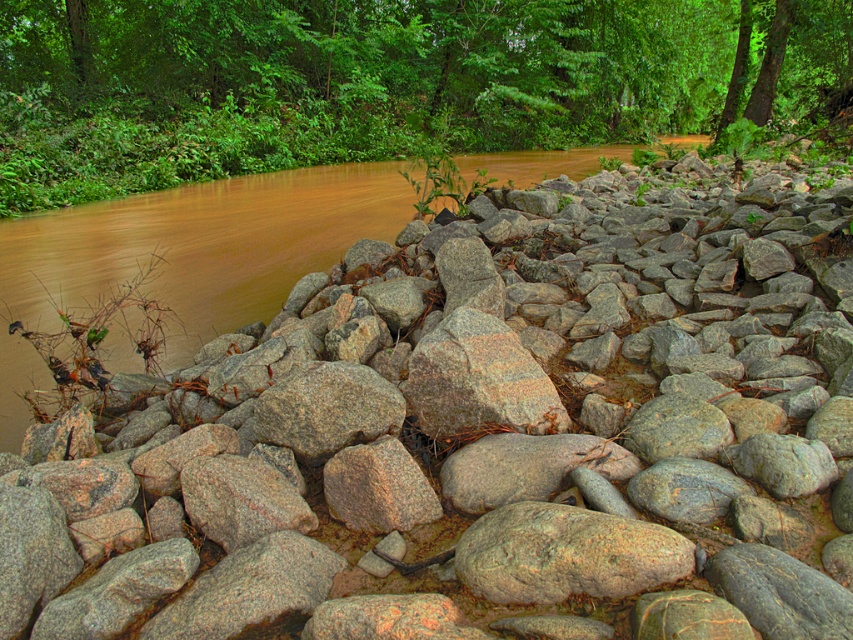
You are standing at the riverbank and see the green leafy tree at upper center and the granite rock at center. Which object is positioned to the right side from your perspective?

The green leafy tree at upper center is positioned to the right of the granite rock at center.

You are navigating a small boat along the river in the image. You see two points marked on the riverbank. The first point is at coordinates point (283, 99), and the second point is at coordinates point (453, 326). Which point is closer to the boat if the boat is positioned at the center of the river?

Point (453, 326) is closer to the boat because it is in front of point (283, 99), which is behind it.